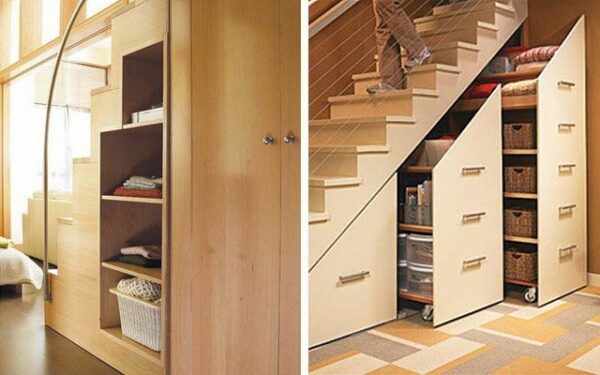
I want to click on brown door, so click(214, 154).